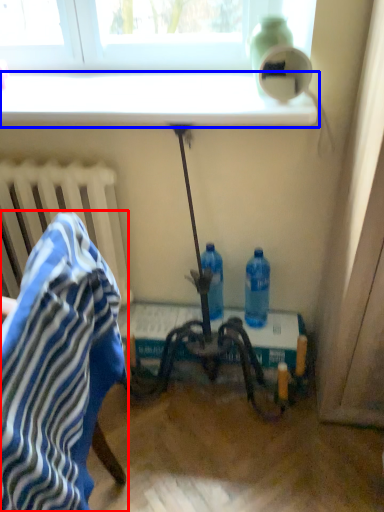
Question: Which object appears farthest to the camera in this image, chair (highlighted by a red box) or window sill (highlighted by a blue box)?

Choices:
 (A) chair
 (B) window sill

Answer: (B)